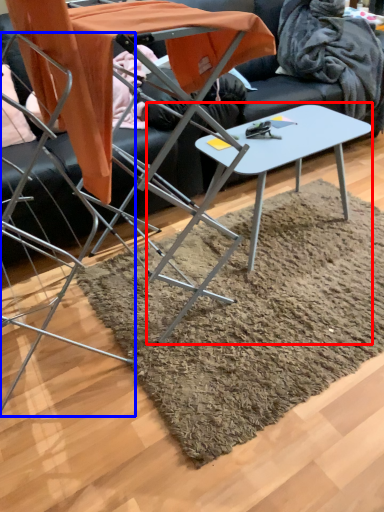
Question: Which object appears closest to the camera in this image, table (highlighted by a red box) or chair (highlighted by a blue box)?

Choices:
 (A) table
 (B) chair

Answer: (B)